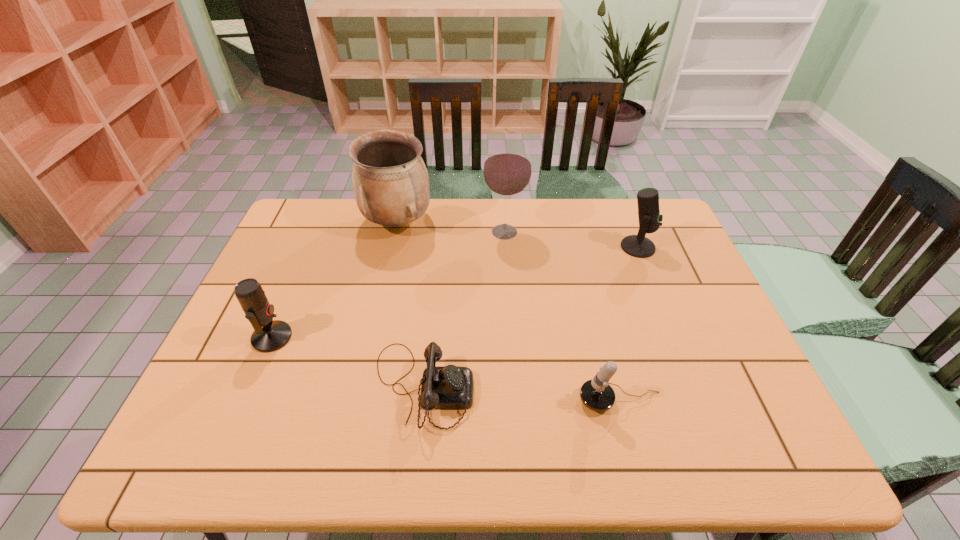
Image resolution: width=960 pixels, height=540 pixels. Identify the location of free spot located 0.260m on the front of the urn. coord(379,305).

Locate an element on the screen. Image resolution: width=960 pixels, height=540 pixels. free space located on the back of the farthest microphone is located at coordinates (629, 225).

Where is `vacant point located on the side of the second farthest microphone with the red ring`? The height and width of the screenshot is (540, 960). vacant point located on the side of the second farthest microphone with the red ring is located at coordinates (311, 337).

You are a GUI agent. You are given a task and a screenshot of the screen. Output one action in this format:
    pyautogui.click(x=<x>, y=<y>)
    Task: Click on the vacant space located on the right of the second object from right to left
    
    Given the screenshot: What is the action you would take?
    pyautogui.click(x=692, y=401)

Where is `free location located 0.350m on the front-facing side of the shortest object`? This screenshot has height=540, width=960. free location located 0.350m on the front-facing side of the shortest object is located at coordinates (623, 387).

Locate an element on the screen. alcohol located in the far edge section of the desktop is located at coordinates (507, 169).

Identify the location of urn that is at the far edge. (390, 181).

Where is `microphone positioned at the far edge`? Image resolution: width=960 pixels, height=540 pixels. microphone positioned at the far edge is located at coordinates (650, 220).

Where is `object that is at the near edge`? The image size is (960, 540). object that is at the near edge is located at coordinates (443, 387).

Locate an element on the screen. This screenshot has height=540, width=960. object located at the left edge is located at coordinates (270, 335).